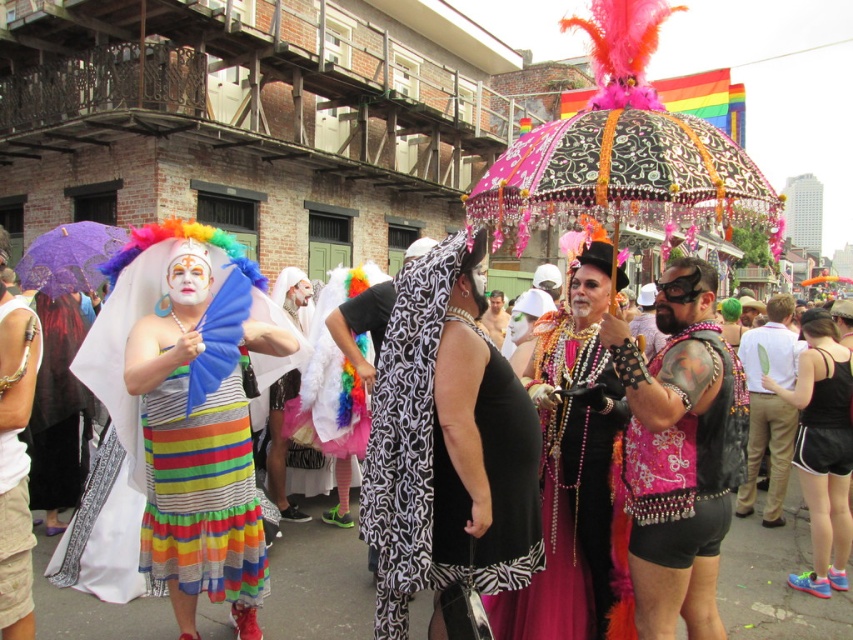
Which of these two, shiny sequined dress at center or purple lace umbrella at upper left, stands taller?

Standing taller between the two is shiny sequined dress at center.

Does shiny sequined dress at center come behind purple lace umbrella at upper left?

No, shiny sequined dress at center is in front of purple lace umbrella at upper left.

Locate an element on the screen. Image resolution: width=853 pixels, height=640 pixels. shiny sequined dress at center is located at coordinates (576, 472).

Can you confirm if pink sequined vest at center-right is smaller than white lace veil at center?

Incorrect, pink sequined vest at center-right is not smaller in size than white lace veil at center.

Between point (711, 529) and point (289, 502), which one is positioned in front?

Point (711, 529) is more forward.

At what (x,y) coordinates should I click in order to perform the action: click on pink sequined vest at center-right. Please return your answer as a coordinate pair (x, y). This screenshot has height=640, width=853. Looking at the image, I should click on (688, 465).

Is striped cotton dress at center in front of purple lace umbrella at upper left?

Yes, striped cotton dress at center is in front of purple lace umbrella at upper left.

Which is in front, point (265, 563) or point (70, 232)?

Point (265, 563)

Describe the element at coordinates (201, 492) in the screenshot. I see `striped cotton dress at center` at that location.

The height and width of the screenshot is (640, 853). I want to click on striped cotton dress at center, so click(201, 492).